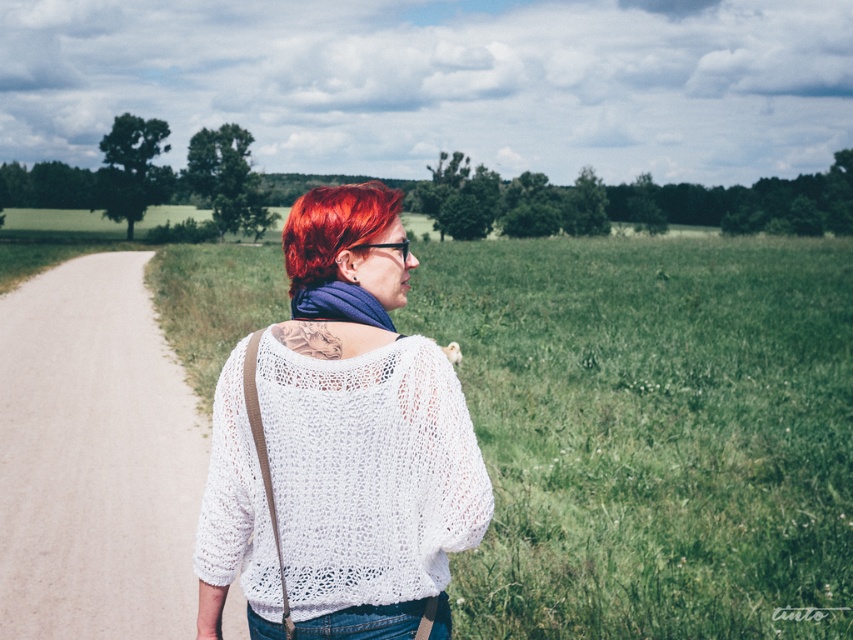
Question: Which point is closer to the camera?

Choices:
 (A) vivid red hair at center
 (B) denim at center
 (C) dirt road at left

Answer: (B)

Question: Does vivid red hair at center have a smaller size compared to denim at center?

Choices:
 (A) yes
 (B) no

Answer: (B)

Question: Can you confirm if dirt road at left is positioned below denim at center?

Choices:
 (A) no
 (B) yes

Answer: (A)

Question: Among these points, which one is nearest to the camera?

Choices:
 (A) (305, 230)
 (B) (234, 608)
 (C) (404, 634)

Answer: (C)

Question: Does green grass at center come behind denim at center?

Choices:
 (A) yes
 (B) no

Answer: (A)

Question: Which point is closer to the camera?

Choices:
 (A) (402, 636)
 (B) (596, 266)
 (C) (340, 250)

Answer: (A)